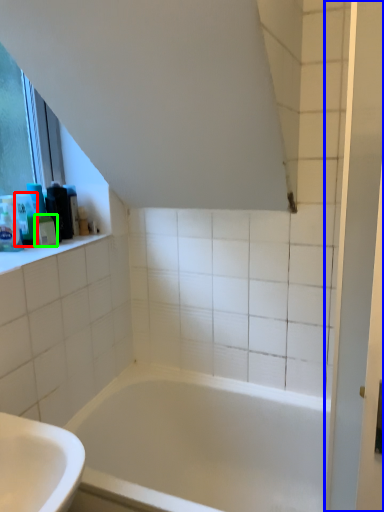
Question: Which is farther away from toiletry (highlighted by a red box)? screen door (highlighted by a blue box) or toiletry (highlighted by a green box)?

Choices:
 (A) screen door
 (B) toiletry

Answer: (A)